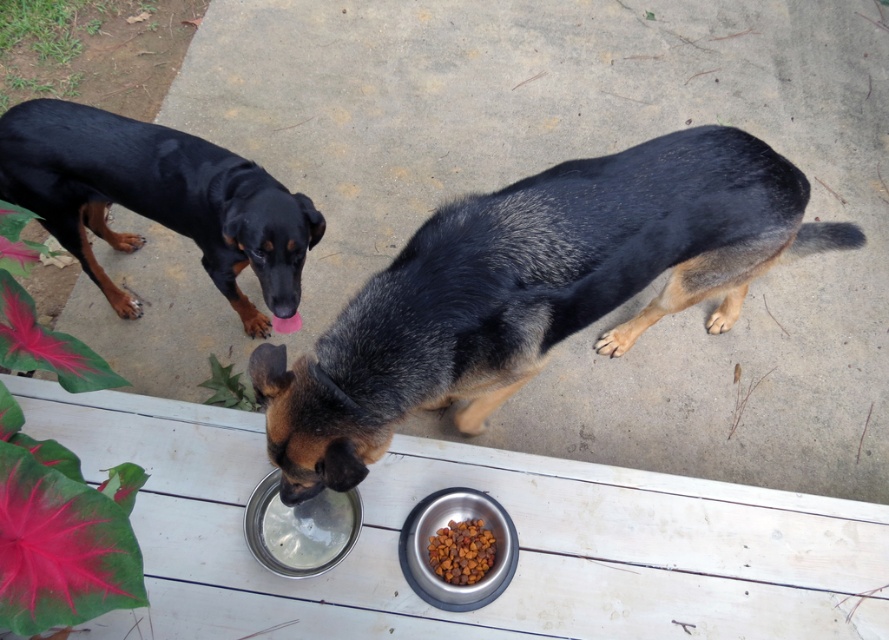
Is black fur dog at center bigger than dry kibble at lower center?

Yes.

Which is in front, point (457, 278) or point (486, 540)?

Positioned in front is point (457, 278).

Which is behind, point (759, 260) or point (459, 561)?

The point (759, 260) is behind.

What are the coordinates of `black fur dog at center` in the screenshot? It's located at (533, 291).

Does black glossy fur at upper left have a greater width compared to metallic silver bowl at lower center?

Indeed, black glossy fur at upper left has a greater width compared to metallic silver bowl at lower center.

Based on the photo, does black glossy fur at upper left have a greater height compared to metallic silver bowl at lower center?

Yes.

Does point (125, 172) come in front of point (514, 532)?

No, (125, 172) is further to viewer.

The height and width of the screenshot is (640, 889). I want to click on black glossy fur at upper left, so click(x=156, y=198).

Is black fur dog at center smaller than black glossy fur at upper left?

No, black fur dog at center is not smaller than black glossy fur at upper left.

Where is `black fur dog at center`? black fur dog at center is located at coordinates (533, 291).

You are a GUI agent. You are given a task and a screenshot of the screen. Output one action in this format:
    pyautogui.click(x=<x>, y=<y>)
    Task: Click on the black fur dog at center
    The height and width of the screenshot is (640, 889).
    Given the screenshot: What is the action you would take?
    pyautogui.click(x=533, y=291)